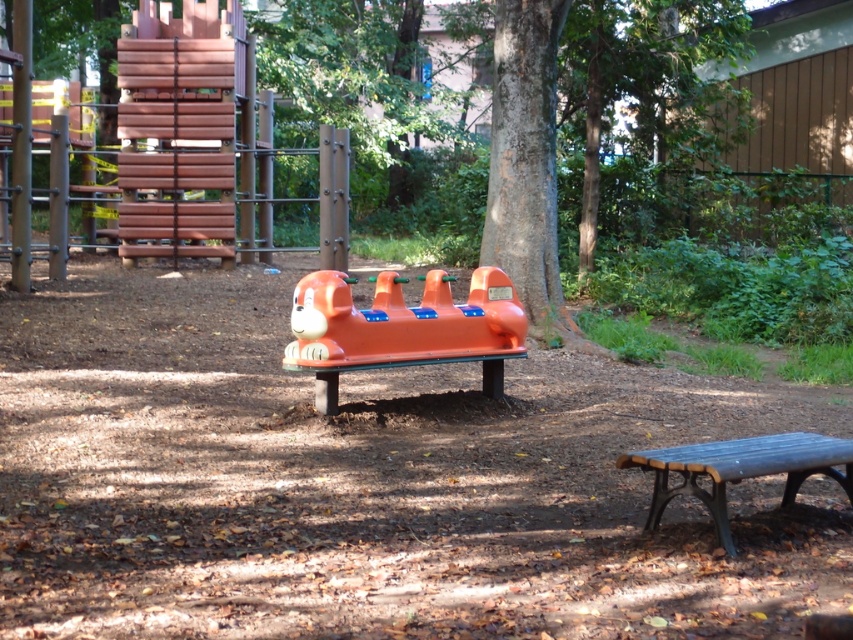
You are standing at the center of the playground. There is an orange plastic toy at center. Where is the orange plastic toy located relative to your current position?

The orange plastic toy at center is located exactly at your current position since you are both at the center of the playground.

You are standing in the playground and want to walk from the orange monkey play structure to the mulch area. Which point, point (328, 392) or point (677, 493), is closer to you as you start walking?

Point (328, 392) is closer to you because it is further to the viewer than point (677, 493), meaning it is nearer in your line of sight.